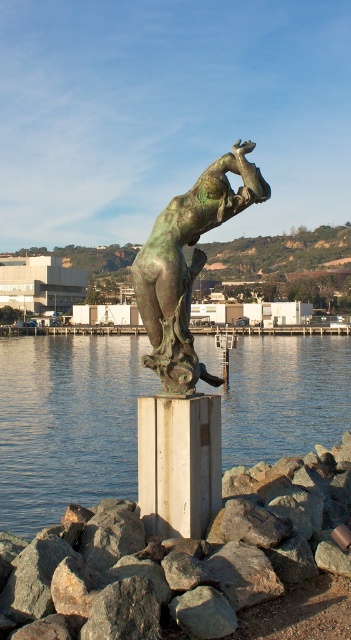
Does green patina water at center appear on the right side of bronze statue at center?

Yes, green patina water at center is to the right of bronze statue at center.

Can you confirm if green patina water at center is thinner than bronze statue at center?

In fact, green patina water at center might be wider than bronze statue at center.

Is point (62, 358) more distant than point (195, 381)?

Yes.

Identify the location of green patina water at center. (67, 422).

Can you confirm if gray rock at lower center is positioned above white wood pillar at center?

Actually, gray rock at lower center is below white wood pillar at center.

Can you confirm if gray rock at lower center is taller than white wood pillar at center?

No.

You are a GUI agent. You are given a task and a screenshot of the screen. Output one action in this format:
    pyautogui.click(x=<x>, y=<y>)
    Task: Click on the gray rock at lower center
    This screenshot has width=351, height=640.
    Given the screenshot: What is the action you would take?
    pyautogui.click(x=180, y=557)

Is green patina water at center thinner than white wood pillar at center?

No.

Does green patina water at center appear on the right side of white wood pillar at center?

Indeed, green patina water at center is positioned on the right side of white wood pillar at center.

Image resolution: width=351 pixels, height=640 pixels. What do you see at coordinates (67, 422) in the screenshot?
I see `green patina water at center` at bounding box center [67, 422].

This screenshot has height=640, width=351. I want to click on green patina water at center, so click(x=67, y=422).